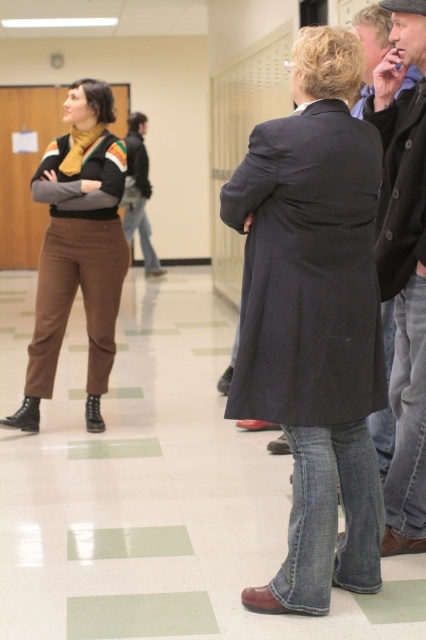
Between dark gray wool coat at center and matte brown pants at left, which one has less height?

With less height is dark gray wool coat at center.

Measure the distance between point (267, 417) and camera.

Point (267, 417) and camera are 2.80 meters apart.

Between point (291, 369) and point (103, 275), which one is positioned in front?

Positioned in front is point (291, 369).

I want to click on dark gray wool coat at center, so click(313, 320).

Is point (97, 337) behind point (143, 196)?

No, (97, 337) is closer to viewer.

Who is positioned more to the right, matte brown pants at left or dark gray jacket at center?

From the viewer's perspective, matte brown pants at left appears more on the right side.

What do you see at coordinates (77, 250) in the screenshot? I see `matte brown pants at left` at bounding box center [77, 250].

What are the coordinates of `matte brown pants at left` in the screenshot? It's located at (77, 250).

Which is behind, point (405, 177) or point (150, 250)?

The point (150, 250) is behind.

Between dark brown leather jacket at right and dark gray jacket at center, which one is positioned lower?

Positioned lower is dark brown leather jacket at right.

I want to click on dark brown leather jacket at right, so click(x=403, y=268).